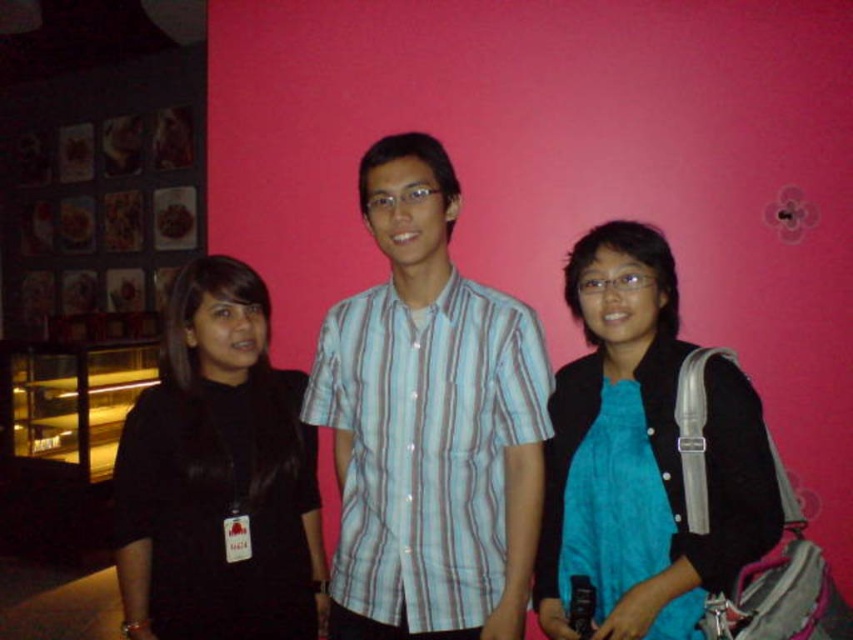
Question: Estimate the real-world distances between objects in this image. Which object is farther from the black matte shirt at left?

Choices:
 (A) light blue striped shirt at center
 (B) blue fabric scarf at center

Answer: (B)

Question: Which object is positioned farthest from the blue fabric scarf at center?

Choices:
 (A) black matte shirt at left
 (B) light blue striped shirt at center

Answer: (A)

Question: Where is light blue striped shirt at center located in relation to blue fabric scarf at center in the image?

Choices:
 (A) below
 (B) above

Answer: (B)

Question: Which point is farther from the camera taking this photo?

Choices:
 (A) (648, 406)
 (B) (167, 440)

Answer: (B)

Question: Does blue fabric scarf at center have a larger size compared to black matte shirt at left?

Choices:
 (A) yes
 (B) no

Answer: (B)

Question: Is light blue striped shirt at center bigger than black matte shirt at left?

Choices:
 (A) yes
 (B) no

Answer: (A)